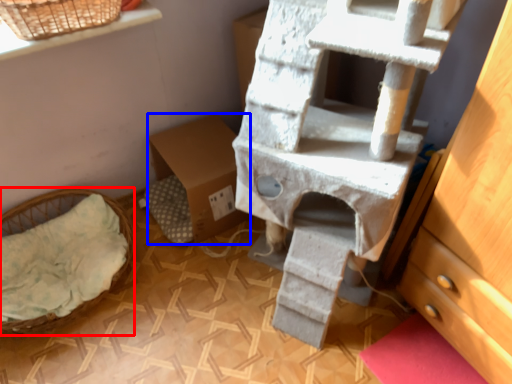
Question: Which point is closer to the camera, furniture (highlighted by a red box) or cardboard box (highlighted by a blue box)?

Choices:
 (A) furniture
 (B) cardboard box

Answer: (A)